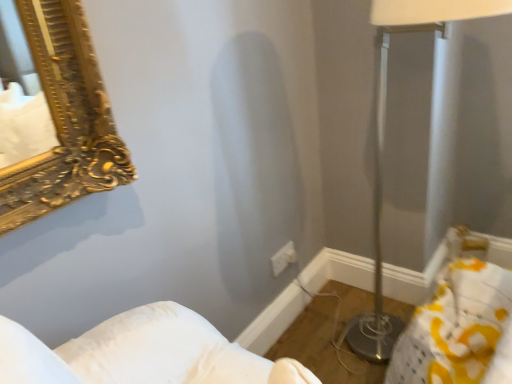
Question: Is white plastic electric outlet at center inside metallic silver table lamp at right?

Choices:
 (A) yes
 (B) no

Answer: (B)

Question: Is metallic silver table lamp at right closer to camera compared to white plastic electric outlet at center?

Choices:
 (A) no
 (B) yes

Answer: (B)

Question: From the image's perspective, is metallic silver table lamp at right on top of white plastic electric outlet at center?

Choices:
 (A) yes
 (B) no

Answer: (A)

Question: Does metallic silver table lamp at right have a larger size compared to white plastic electric outlet at center?

Choices:
 (A) yes
 (B) no

Answer: (A)

Question: From a real-world perspective, is metallic silver table lamp at right on top of white plastic electric outlet at center?

Choices:
 (A) no
 (B) yes

Answer: (B)

Question: Does metallic silver table lamp at right come behind white plastic electric outlet at center?

Choices:
 (A) no
 (B) yes

Answer: (A)

Question: Considering the relative positions of white plastic electric outlet at center and metallic silver table lamp at right in the image provided, is white plastic electric outlet at center in front of metallic silver table lamp at right?

Choices:
 (A) no
 (B) yes

Answer: (A)

Question: Can you see white plastic electric outlet at center touching metallic silver table lamp at right?

Choices:
 (A) no
 (B) yes

Answer: (A)

Question: Considering the relative positions of white plastic electric outlet at center and metallic silver table lamp at right in the image provided, is white plastic electric outlet at center to the right of metallic silver table lamp at right from the viewer's perspective?

Choices:
 (A) yes
 (B) no

Answer: (B)

Question: From a real-world perspective, is white plastic electric outlet at center located higher than metallic silver table lamp at right?

Choices:
 (A) no
 (B) yes

Answer: (A)

Question: Considering the relative positions of white plastic electric outlet at center and metallic silver table lamp at right in the image provided, is white plastic electric outlet at center behind metallic silver table lamp at right?

Choices:
 (A) yes
 (B) no

Answer: (A)

Question: Does white plastic electric outlet at center appear on the left side of metallic silver table lamp at right?

Choices:
 (A) yes
 (B) no

Answer: (A)

Question: Based on their positions, is white plastic electric outlet at center located to the left or right of metallic silver table lamp at right?

Choices:
 (A) left
 (B) right

Answer: (A)